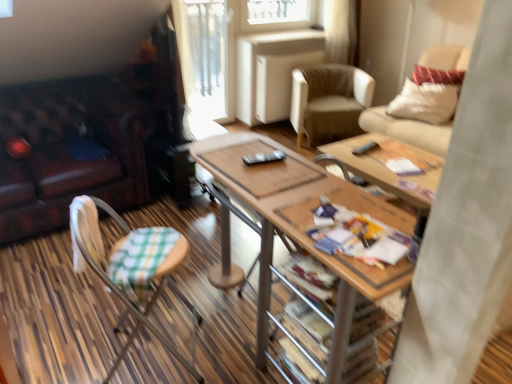
Identify the location of vacant region above woodenmaterial/texturetable at center (from a real-world perspective). The image size is (512, 384). (291, 188).